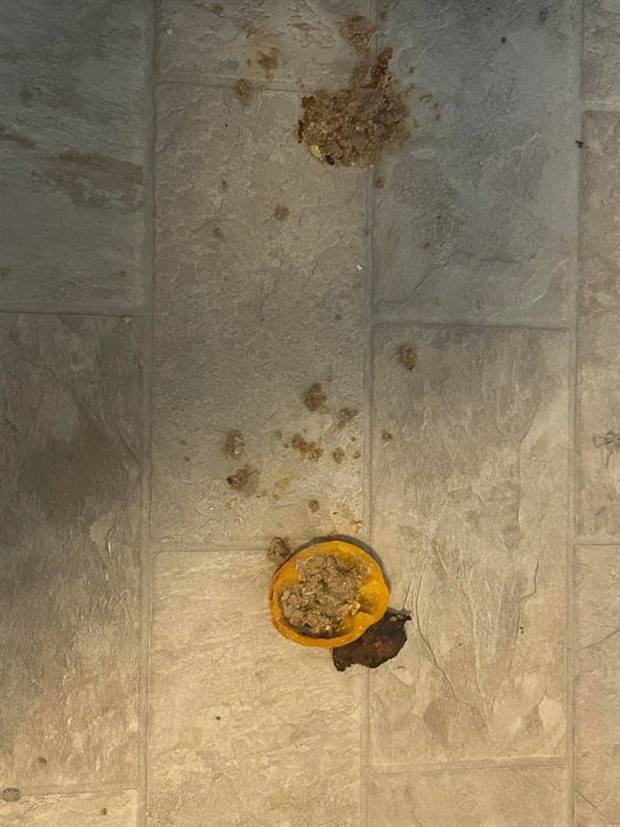
In order to click on tile in this screenshot , I will do `click(514, 600)`.